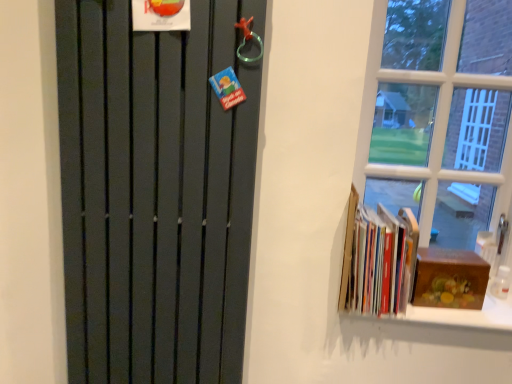
Measure the distance between matte black radiator at left and camera.

matte black radiator at left is 3.44 feet away from camera.

Describe the element at coordinates (381, 261) in the screenshot. I see `hardcover books at right` at that location.

Locate an element on the screen. This screenshot has height=384, width=512. wooden box at right is located at coordinates (450, 279).

Looking at this image, is wooden box at right not near hardcover books at right?

wooden box at right is actually quite close to hardcover books at right.

Considering the points (419, 277) and (412, 286), which point is in front, point (419, 277) or point (412, 286)?

Positioned in front is point (412, 286).

Does wooden box at right turn towards hardcover books at right?

No, wooden box at right is not turned towards hardcover books at right.

Consider the image. Who is taller, wooden box at right or hardcover books at right?

Standing taller between the two is hardcover books at right.

The width and height of the screenshot is (512, 384). Find the location of `door in front of the wooden box at right`. door in front of the wooden box at right is located at coordinates (155, 193).

Consider the image. Does matte black radiator at left have a smaller size compared to wooden box at right?

No, matte black radiator at left is not smaller than wooden box at right.

Which is more distant, (105, 90) or (433, 265)?

The point (433, 265) is more distant.

Which is more to the right, matte black radiator at left or wooden box at right?

Positioned to the right is wooden box at right.

Can you see hardcover books at right touching wooden box at right?

No, hardcover books at right is not next to wooden box at right.

Is hardcover books at right positioned with its back to wooden box at right?

No, hardcover books at right is not facing the opposite direction of wooden box at right.

Can you tell me how much hardcover books at right and wooden box at right differ in facing direction?

0.191 degrees separate the facing orientations of hardcover books at right and wooden box at right.

Would you say hardcover books at right is outside wooden box at right?

Absolutely, hardcover books at right is external to wooden box at right.

From the image's perspective, is hardcover books at right positioned above or below matte black radiator at left?

Based on their image positions, hardcover books at right is located beneath matte black radiator at left.

Considering the sizes of hardcover books at right and matte black radiator at left in the image, is hardcover books at right wider or thinner than matte black radiator at left?

Considering their sizes, hardcover books at right looks broader than matte black radiator at left.

Is hardcover books at right inside or outside of matte black radiator at left?

hardcover books at right is spatially situated outside matte black radiator at left.

Can you confirm if hardcover books at right is positioned to the left of matte black radiator at left?

No, hardcover books at right is not to the left of matte black radiator at left.

Where is `book behind the matte black radiator at left`? This screenshot has width=512, height=384. book behind the matte black radiator at left is located at coordinates (381, 261).

How far apart are matte black radiator at left and hardcover books at right?

matte black radiator at left and hardcover books at right are 20.83 inches apart from each other.

Consider the image. From the image's perspective, is matte black radiator at left above hardcover books at right?

Yes, from the image's perspective, matte black radiator at left is above hardcover books at right.

Consider the image. In terms of height, does matte black radiator at left look taller or shorter compared to hardcover books at right?

Considering their sizes, matte black radiator at left has more height than hardcover books at right.

Identify the location of door that is above the wooden box at right (from a real-world perspective). (155, 193).

Is wooden box at right oriented away from matte black radiator at left?

No, wooden box at right's orientation is not away from matte black radiator at left.

Would you say wooden box at right contains matte black radiator at left?

No, wooden box at right does not contain matte black radiator at left.

Which of these two, wooden box at right or matte black radiator at left, is smaller?

Smaller between the two is wooden box at right.

The width and height of the screenshot is (512, 384). What are the coordinates of `paperback book to the right of hardcover books at right` in the screenshot? It's located at (450, 279).

The height and width of the screenshot is (384, 512). Identify the location of door in front of the wooden box at right. (155, 193).

From the image, which object appears to be farther from wooden box at right, matte black radiator at left or hardcover books at right?

matte black radiator at left is further to wooden box at right.

From the image, which object appears to be nearer to wooden box at right, hardcover books at right or matte black radiator at left?

Among the two, hardcover books at right is located nearer to wooden box at right.

When comparing their distances from matte black radiator at left, does wooden box at right or hardcover books at right seem further?

The object further to matte black radiator at left is wooden box at right.

Estimate the real-world distances between objects in this image. Which object is closer to matte black radiator at left, hardcover books at right or wooden box at right?

hardcover books at right lies closer to matte black radiator at left than the other object.

Based on their spatial positions, is matte black radiator at left or wooden box at right closer to hardcover books at right?

Based on the image, wooden box at right appears to be nearer to hardcover books at right.

From the picture: Estimate the real-world distances between objects in this image. Which object is further from hardcover books at right, wooden box at right or matte black radiator at left?

The object further to hardcover books at right is matte black radiator at left.

This screenshot has height=384, width=512. I want to click on book between matte black radiator at left and wooden box at right, so click(381, 261).